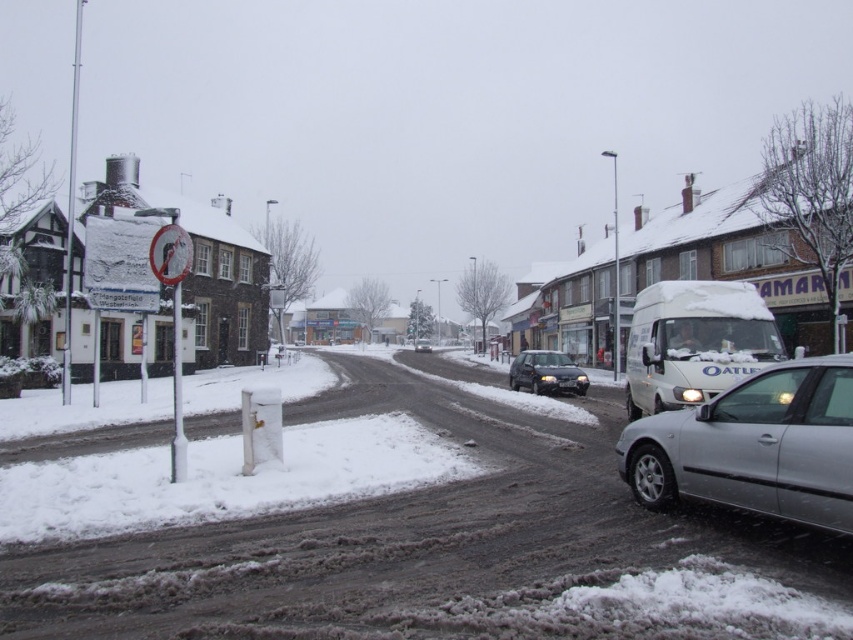
Question: Which of these objects is positioned closest to the matte black car at center?

Choices:
 (A) silver metallic car at right
 (B) white matte van at right
 (C) silver metallic sedan at center

Answer: (B)

Question: Among these points, which one is nearest to the camera?

Choices:
 (A) (427, 349)
 (B) (514, 362)

Answer: (B)

Question: Does white matte van at right appear over silver metallic sedan at center?

Choices:
 (A) no
 (B) yes

Answer: (B)

Question: Among these points, which one is farthest from the camera?

Choices:
 (A) (851, 387)
 (B) (424, 342)

Answer: (B)

Question: Is the position of white matte van at right less distant than that of matte black car at center?

Choices:
 (A) yes
 (B) no

Answer: (A)

Question: Can you confirm if silver metallic car at right is wider than matte black car at center?

Choices:
 (A) yes
 (B) no

Answer: (B)